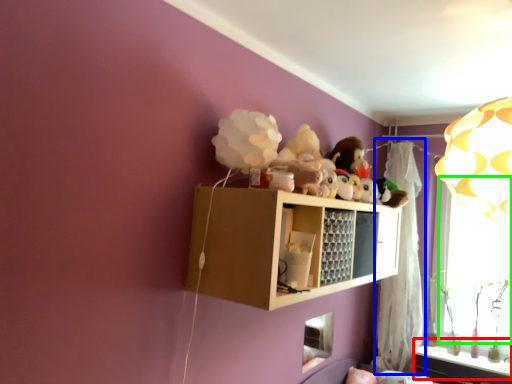
Question: Based on their relative distances, which object is farther from window sill (highlighted by a red box)? Choose from curtain (highlighted by a blue box) and window screen (highlighted by a green box).

Choices:
 (A) curtain
 (B) window screen

Answer: (B)